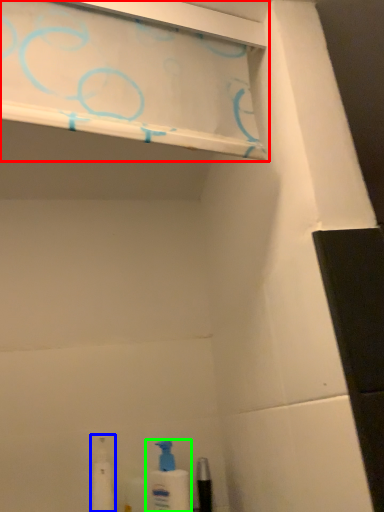
Question: Which object is positioned closest to shelf (highlighted by a red box)? Select from toiletry (highlighted by a blue box) and cleaning product (highlighted by a green box).

Choices:
 (A) toiletry
 (B) cleaning product

Answer: (B)